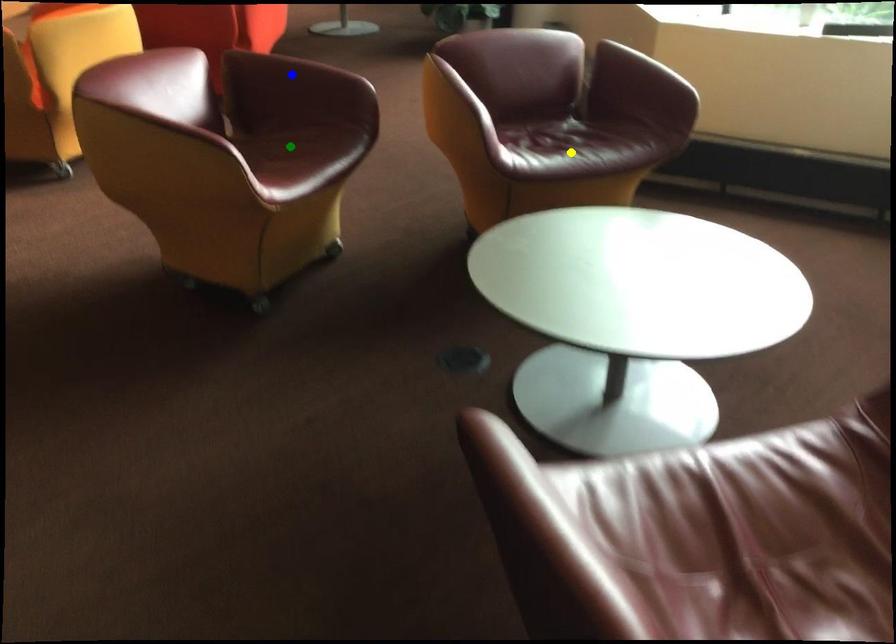
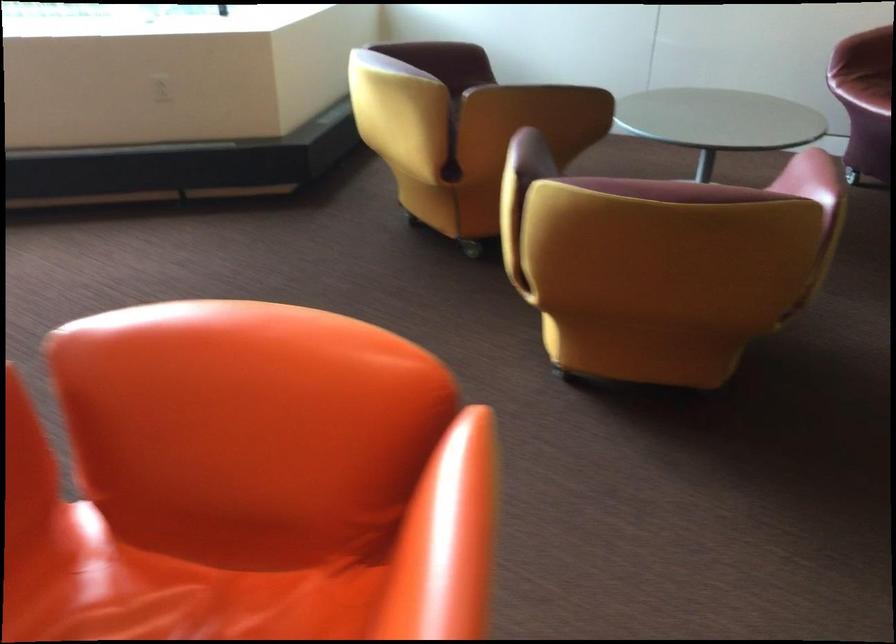
I am providing you with two images of the same scene from different viewpoints. Three points are marked in image1. Which point corresponds to a part or object that is occluded in image2?In image1, three points are marked. Which of them correspond to a part or object that is occluded in image2?Among the three points shown in image1, which one corresponds to a part or object that is no longer visible due to occlusion in image2?

blue point, yellow point, green point cannot be seen in image2.